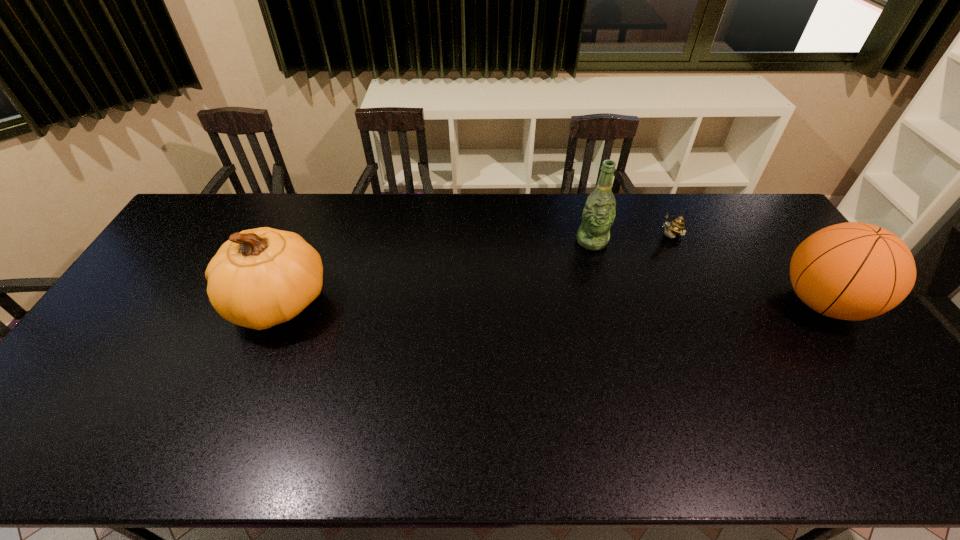
Where is `vacant space on the desktop that is between the pumpkin and the basketball and is positioned on the surface of the third object from right to left`? The image size is (960, 540). vacant space on the desktop that is between the pumpkin and the basketball and is positioned on the surface of the third object from right to left is located at coordinates (610, 303).

Where is `free space on the desktop that is between the leftmost object and the rightmost object and is positioned on the face of the snail`? This screenshot has width=960, height=540. free space on the desktop that is between the leftmost object and the rightmost object and is positioned on the face of the snail is located at coordinates (549, 303).